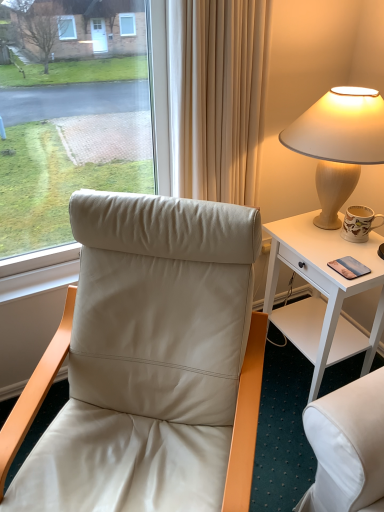
Question: Is metallic silver phone at right situated inside white wood desk at right or outside?

Choices:
 (A) inside
 (B) outside

Answer: (A)

Question: In terms of height, does metallic silver phone at right look taller or shorter compared to white wood desk at right?

Choices:
 (A) short
 (B) tall

Answer: (A)

Question: Which object is positioned farthest from the matte ceramic mug at right?

Choices:
 (A) white wood desk at right
 (B) metallic silver phone at right
 (C) matte beige lamp at upper right
 (D) leather at left

Answer: (D)

Question: Estimate the real-world distances between objects in this image. Which object is closer to the white wood desk at right?

Choices:
 (A) matte ceramic mug at right
 (B) metallic silver phone at right
 (C) matte beige lamp at upper right
 (D) leather at left

Answer: (A)